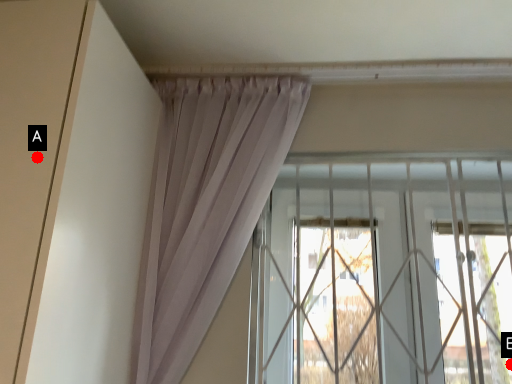
Question: Two points are circled on the image, labeled by A and B beside each circle. Which point is closer to the camera?

Choices:
 (A) A is closer
 (B) B is closer

Answer: (A)